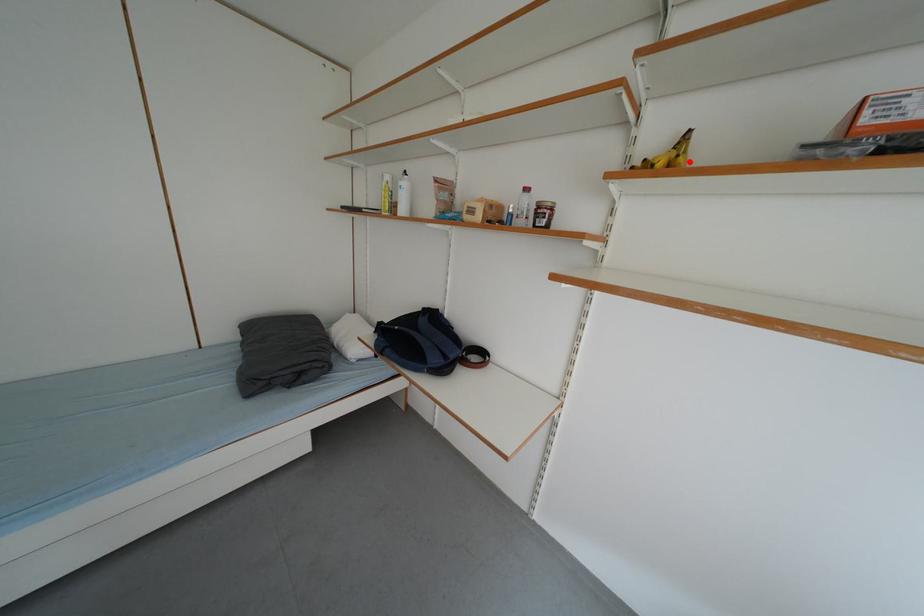
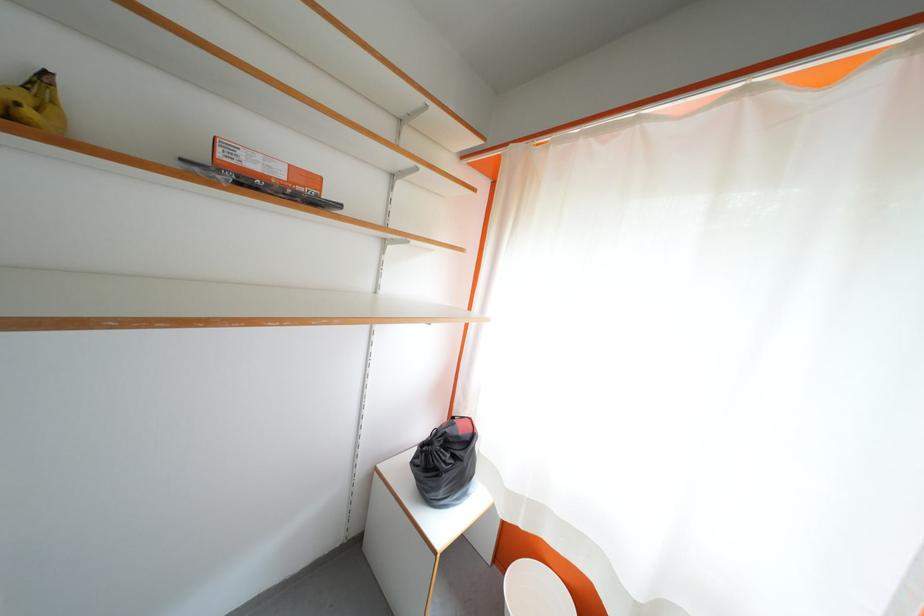
In the second image, find the point that corresponds to the highlighted location in the first image.

(38, 115)